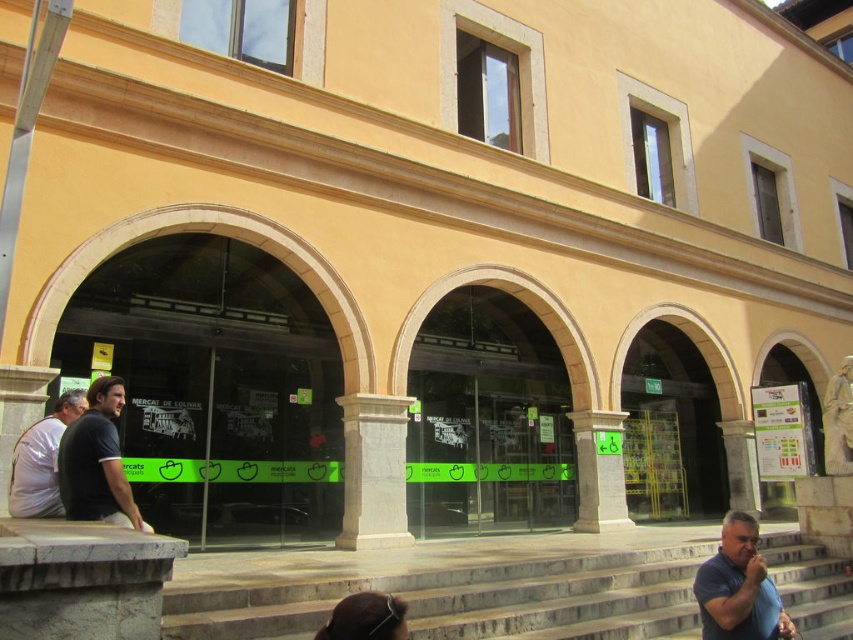
Between gray stone column at center and dark blue shirt at lower right, which one has more height?

gray stone column at center

Where is `gray stone column at center`? Image resolution: width=853 pixels, height=640 pixels. gray stone column at center is located at coordinates (374, 472).

I want to click on gray stone column at center, so click(x=374, y=472).

Is dark gray t-shirt at left shorter than white matte shirt at left?

Incorrect, dark gray t-shirt at left's height does not fall short of white matte shirt at left's.

Between point (102, 388) and point (41, 500), which one is positioned in front?

Positioned in front is point (41, 500).

The image size is (853, 640). Find the location of `dark gray t-shirt at left`. dark gray t-shirt at left is located at coordinates (96, 461).

Is smooth stone stairs at lower center thinner than dark blue shirt at lower right?

Incorrect, smooth stone stairs at lower center's width is not less than dark blue shirt at lower right's.

Does smooth stone stairs at lower center lie behind dark blue shirt at lower right?

Yes, smooth stone stairs at lower center is behind dark blue shirt at lower right.

Is point (302, 611) closer to camera compared to point (775, 630)?

No, (302, 611) is further to viewer.

I want to click on smooth stone stairs at lower center, so click(x=465, y=596).